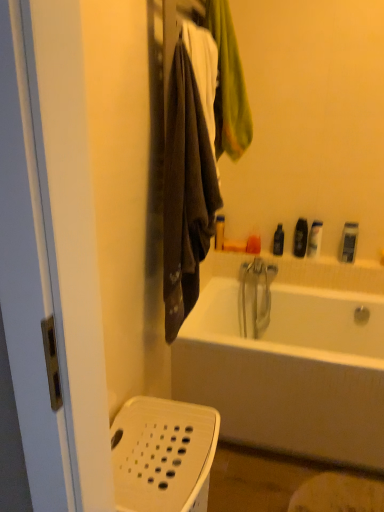
Question: Is dark brown fabric towel at left not near black plastic bottle at upper right, marked as the fourth toiletry in a left-to-right arrangement?

Choices:
 (A) no
 (B) yes

Answer: (B)

Question: Does dark brown fabric towel at left have a lesser width compared to black plastic bottle at upper right, marked as the fourth toiletry in a left-to-right arrangement?

Choices:
 (A) no
 (B) yes

Answer: (A)

Question: Is dark brown fabric towel at left surrounding black plastic bottle at upper right, which is counted as the third toiletry, starting from the right?

Choices:
 (A) yes
 (B) no

Answer: (B)

Question: Considering the relative sizes of dark brown fabric towel at left and black plastic bottle at upper right, marked as the fourth toiletry in a left-to-right arrangement, in the image provided, is dark brown fabric towel at left smaller than black plastic bottle at upper right, marked as the fourth toiletry in a left-to-right arrangement,?

Choices:
 (A) yes
 (B) no

Answer: (B)

Question: Would you say dark brown fabric towel at left is outside black plastic bottle at upper right, which is counted as the third toiletry, starting from the right?

Choices:
 (A) no
 (B) yes

Answer: (B)

Question: From a real-world perspective, is dark brown fabric towel at left positioned over black plastic bottle at upper right, which is counted as the third toiletry, starting from the right, based on gravity?

Choices:
 (A) no
 (B) yes

Answer: (B)

Question: From the image's perspective, does black plastic bottle at upper right, the 3th toiletry in the left-to-right sequence, appear higher than white plastic razor at upper right, the 6th toiletry when ordered from left to right?

Choices:
 (A) no
 (B) yes

Answer: (B)

Question: Does black plastic bottle at upper right, the 3th toiletry in the left-to-right sequence, have a lesser width compared to white plastic razor at upper right, which is counted as the first toiletry, starting from the right?

Choices:
 (A) no
 (B) yes

Answer: (B)

Question: Is black plastic bottle at upper right, which is the 4th toiletry in right-to-left order, next to white plastic razor at upper right, which is counted as the first toiletry, starting from the right, and touching it?

Choices:
 (A) yes
 (B) no

Answer: (B)

Question: Could you tell me if black plastic bottle at upper right, which is the 4th toiletry in right-to-left order, is facing white plastic razor at upper right, the 6th toiletry when ordered from left to right?

Choices:
 (A) no
 (B) yes

Answer: (A)

Question: Considering the relative positions of black plastic bottle at upper right, which is the 4th toiletry in right-to-left order, and white plastic razor at upper right, which is counted as the first toiletry, starting from the right, in the image provided, is black plastic bottle at upper right, which is the 4th toiletry in right-to-left order, to the right of white plastic razor at upper right, which is counted as the first toiletry, starting from the right, from the viewer's perspective?

Choices:
 (A) no
 (B) yes

Answer: (A)

Question: Is black plastic bottle at upper right, the 3th toiletry in the left-to-right sequence, at the left side of white plastic razor at upper right, the 6th toiletry when ordered from left to right?

Choices:
 (A) yes
 (B) no

Answer: (A)

Question: From the image's perspective, is black plastic bottle at upper right, the 3th toiletry in the left-to-right sequence, beneath orange matte soap at upper center, marked as the 5th toiletry in a right-to-left arrangement?

Choices:
 (A) yes
 (B) no

Answer: (B)